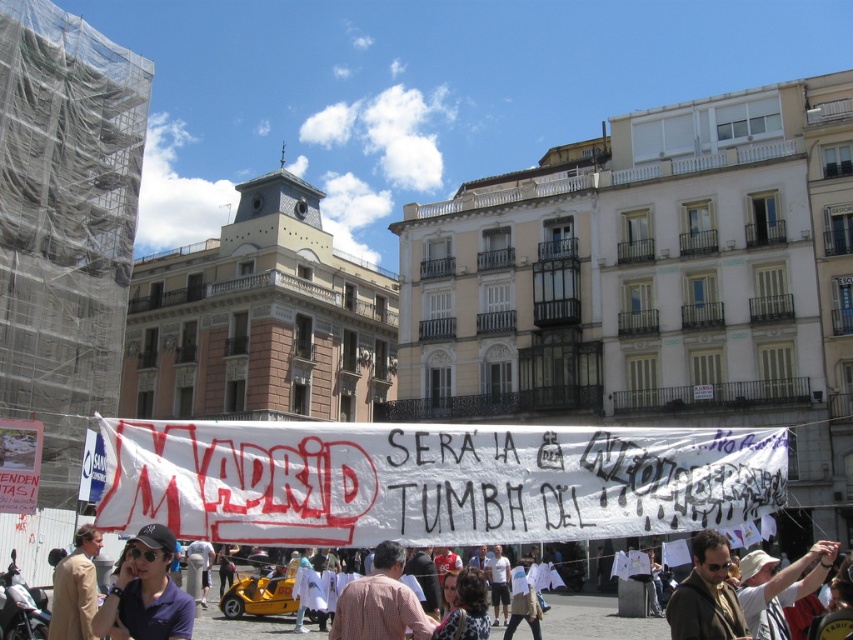
Is dark blue fabric cap at lower left above plaid shirt at center?

Yes, dark blue fabric cap at lower left is above plaid shirt at center.

Which is below, dark blue fabric cap at lower left or plaid shirt at center?

plaid shirt at center is lower down.

Between point (141, 572) and point (357, 634), which one is positioned behind?

Point (357, 634)

The image size is (853, 640). In order to click on dark blue fabric cap at lower left in this screenshot , I will do `click(146, 593)`.

How far apart are plaid shirt at center and beige wool coat at lower left?

They are 7.52 meters apart.

Is plaid shirt at center bigger than beige wool coat at lower left?

Incorrect, plaid shirt at center is not larger than beige wool coat at lower left.

Locate an element on the screen. This screenshot has height=640, width=853. plaid shirt at center is located at coordinates (380, 602).

Can you confirm if dark blue fabric cap at lower left is bigger than beige wool coat at lower left?

Actually, dark blue fabric cap at lower left might be smaller than beige wool coat at lower left.

Is dark blue fabric cap at lower left to the right of beige wool coat at lower left from the viewer's perspective?

Correct, you'll find dark blue fabric cap at lower left to the right of beige wool coat at lower left.

Between point (114, 614) and point (94, 598), which one is positioned behind?

Point (94, 598)

Find the location of a particular element. The image size is (853, 640). dark blue fabric cap at lower left is located at coordinates (146, 593).